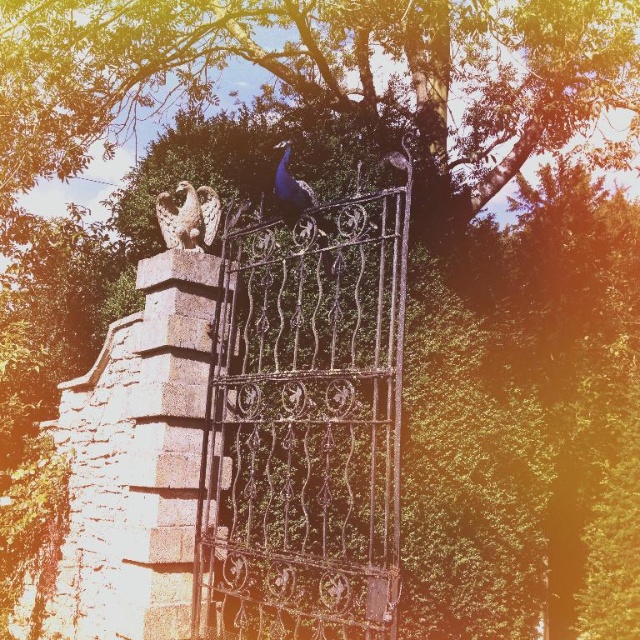
Can you confirm if stone eagle at upper center is positioned above shiny blue peacock at center?

No.

Where is `stone eagle at upper center`? The width and height of the screenshot is (640, 640). stone eagle at upper center is located at coordinates tap(188, 218).

Is wrought iron gate at center in front of stone eagle at upper center?

Yes, wrought iron gate at center is in front of stone eagle at upper center.

In the scene shown: Is wrought iron gate at center above stone eagle at upper center?

Incorrect, wrought iron gate at center is not positioned above stone eagle at upper center.

At what (x,y) coordinates should I click in order to perform the action: click on wrought iron gate at center. Please return your answer as a coordinate pair (x, y). This screenshot has width=640, height=640. Looking at the image, I should click on (307, 426).

I want to click on wrought iron gate at center, so click(307, 426).

Measure the distance from wrought iron gate at center to shiny blue peacock at center.

wrought iron gate at center and shiny blue peacock at center are 4.12 feet apart from each other.

Is wrought iron gate at center above shiny blue peacock at center?

Actually, wrought iron gate at center is below shiny blue peacock at center.

Where is `wrought iron gate at center`? wrought iron gate at center is located at coordinates (307, 426).

In order to click on wrought iron gate at center in this screenshot , I will do pos(307,426).